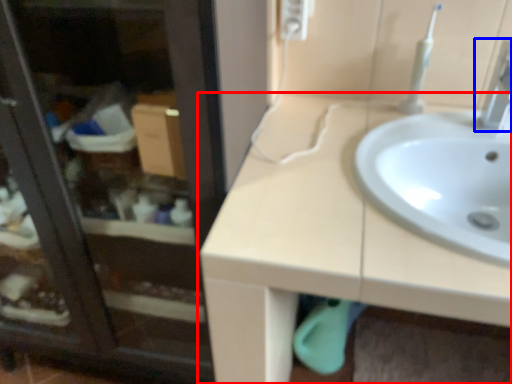
Question: Among these objects, which one is nearest to the camera, countertop (highlighted by a red box) or tap (highlighted by a blue box)?

Choices:
 (A) countertop
 (B) tap

Answer: (A)